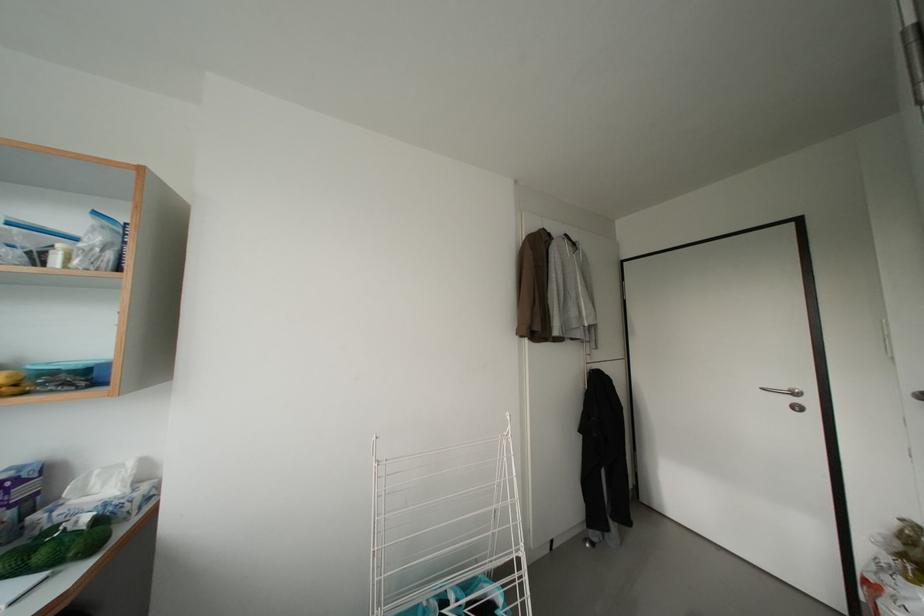
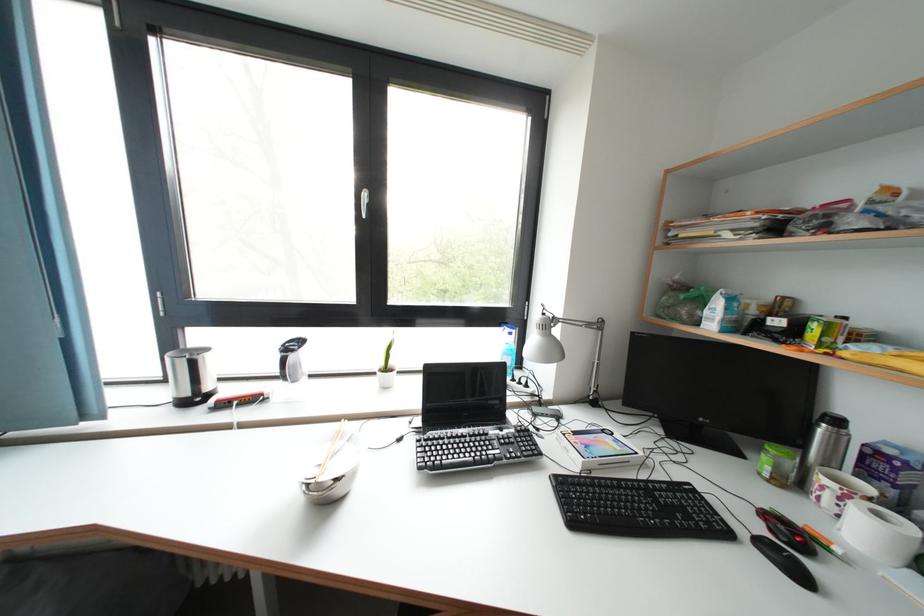
Question: The camera is either moving clockwise (left) or counter-clockwise (right) around the object. The first image is from the beginning of the video and the second image is from the end. Is the camera moving left or right when shooting the video?

Choices:
 (A) Left
 (B) Right

Answer: (B)